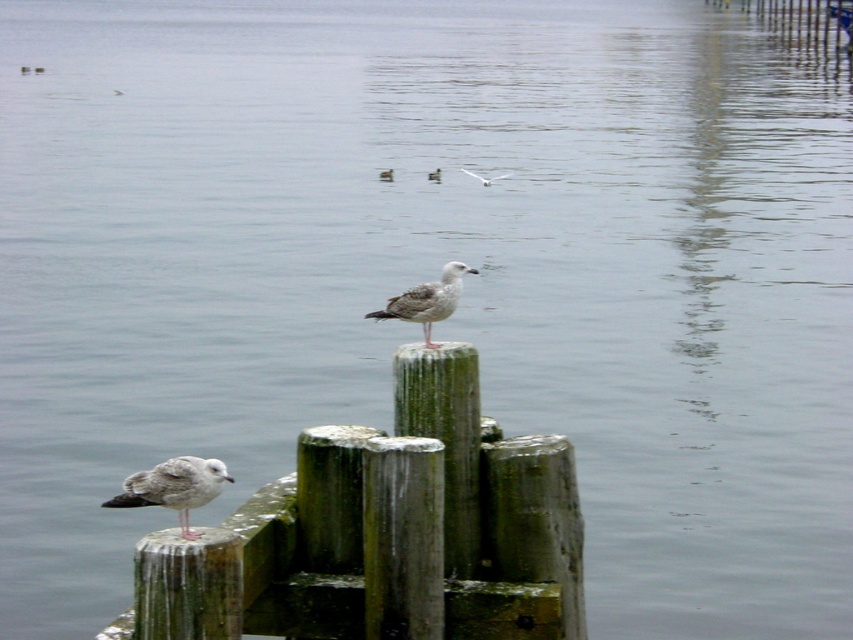
Question: Estimate the real-world distances between objects in this image. Which object is closer to the white feathered bird at upper center?

Choices:
 (A) white feathered bird at center
 (B) gray feathered bird at center

Answer: (A)

Question: Is green mossy wood post at lower left above white feathered bird at center?

Choices:
 (A) no
 (B) yes

Answer: (A)

Question: Which point is farther to the camera?

Choices:
 (A) speckled feathered seagull at lower left
 (B) speckled feathered seagull at center

Answer: (B)

Question: Is the position of green mossy wood post at lower left more distant than that of gray feathered bird at center?

Choices:
 (A) no
 (B) yes

Answer: (A)

Question: Which object is closer to the camera taking this photo?

Choices:
 (A) speckled feathered seagull at lower left
 (B) weathered wood post at center
 (C) white feathered bird at upper center

Answer: (A)

Question: Can you confirm if weathered wood post at center is positioned below gray feathered bird at center?

Choices:
 (A) no
 (B) yes

Answer: (B)